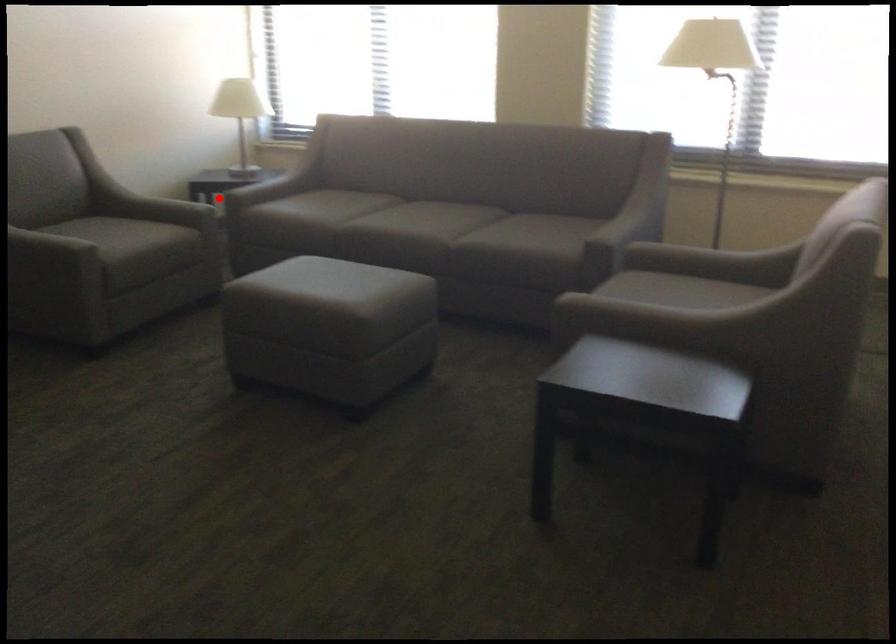
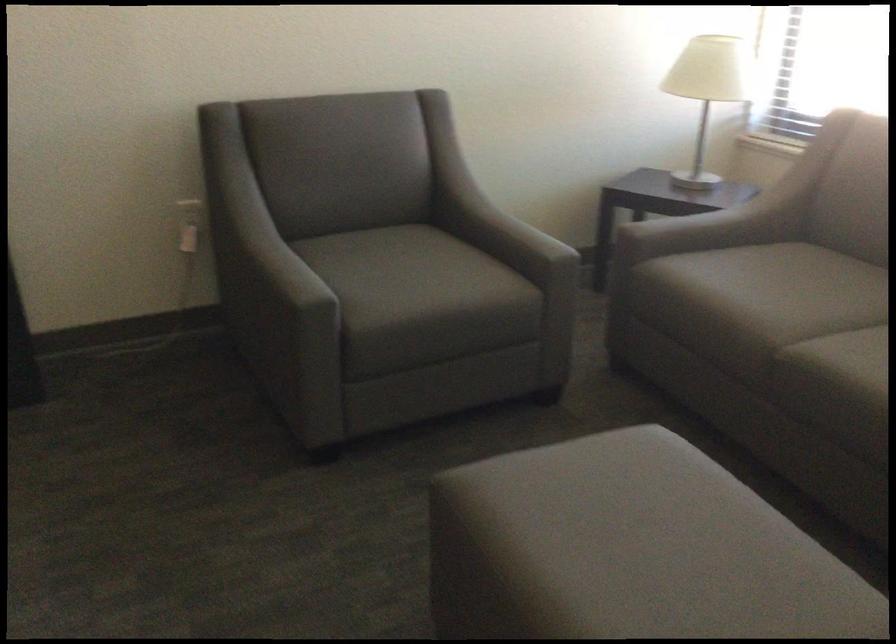
Question: I am providing you with two images of the same scene from different viewpoints. In image1, a red point is highlighted. Considering the same 3D point in image2, which of the following is correct?

Choices:
 (A) It is closer
 (B) It is farther

Answer: (A)